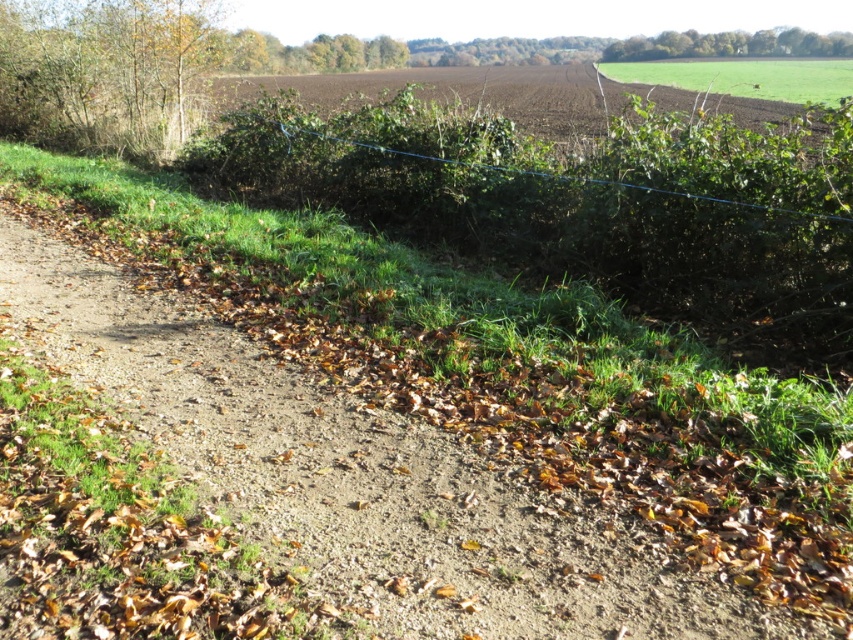
Is point (535, 627) behind point (807, 67)?

That is False.

Where is `brown gravel trail at lower left`? This screenshot has width=853, height=640. brown gravel trail at lower left is located at coordinates (347, 474).

What are the coordinates of `brown gravel trail at lower left` in the screenshot? It's located at (347, 474).